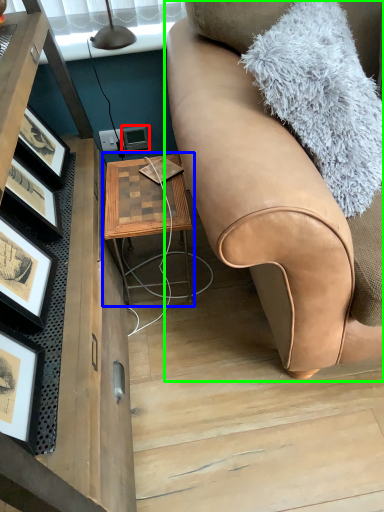
Question: Considering the real-world distances, which object is closest to picture frame (highlighted by a red box)? table (highlighted by a blue box) or studio couch (highlighted by a green box).

Choices:
 (A) table
 (B) studio couch

Answer: (A)